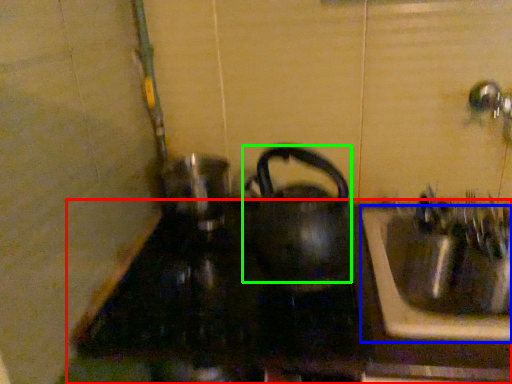
Question: Which object is positioned farthest from counter top (highlighted by a red box)? Select from sink (highlighted by a blue box) and kettle (highlighted by a green box).

Choices:
 (A) sink
 (B) kettle

Answer: (B)